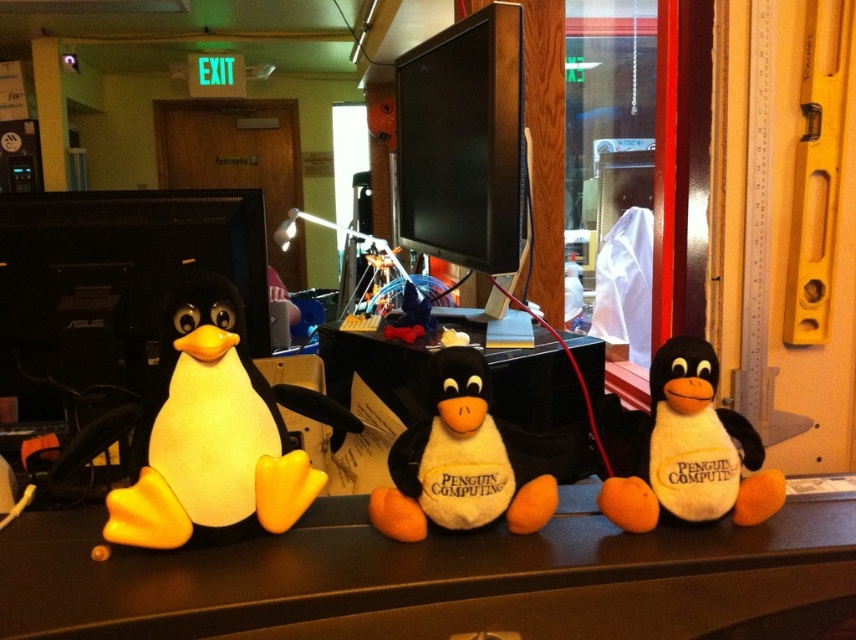
Question: Observing the image, what is the correct spatial positioning of white matte table at center in reference to white soft plush penguin at center?

Choices:
 (A) right
 (B) left

Answer: (B)

Question: Which point is closer to the camera taking this photo?

Choices:
 (A) (574, 618)
 (B) (509, 522)

Answer: (A)

Question: Which object is the farthest from the white soft plush penguin at center?

Choices:
 (A) white plush penguin at center
 (B) yellow felt penguin at left
 (C) white matte table at center

Answer: (A)

Question: Does yellow felt penguin at left appear on the right side of white soft plush penguin at center?

Choices:
 (A) yes
 (B) no

Answer: (B)

Question: Which of the following is the closest to the observer?

Choices:
 (A) (223, 320)
 (B) (785, 560)
 (C) (605, 419)
 (D) (419, 528)

Answer: (B)

Question: Is white matte table at center closer to the viewer compared to white plush penguin at center?

Choices:
 (A) yes
 (B) no

Answer: (A)